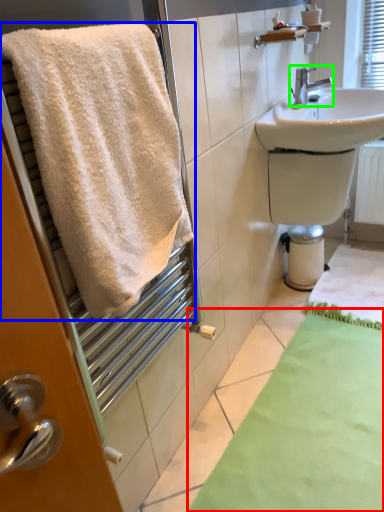
Question: Which object is the farthest from bath mat (highlighted by a red box)? Choose among these: towel (highlighted by a blue box) or tap (highlighted by a green box).

Choices:
 (A) towel
 (B) tap

Answer: (B)